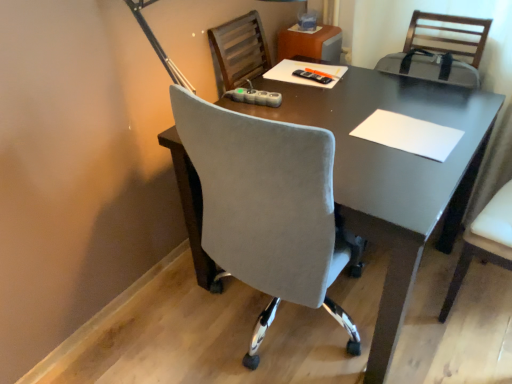
Find the location of a particular element. The width and height of the screenshot is (512, 384). space that is in front of black plastic remote control at center is located at coordinates point(324,95).